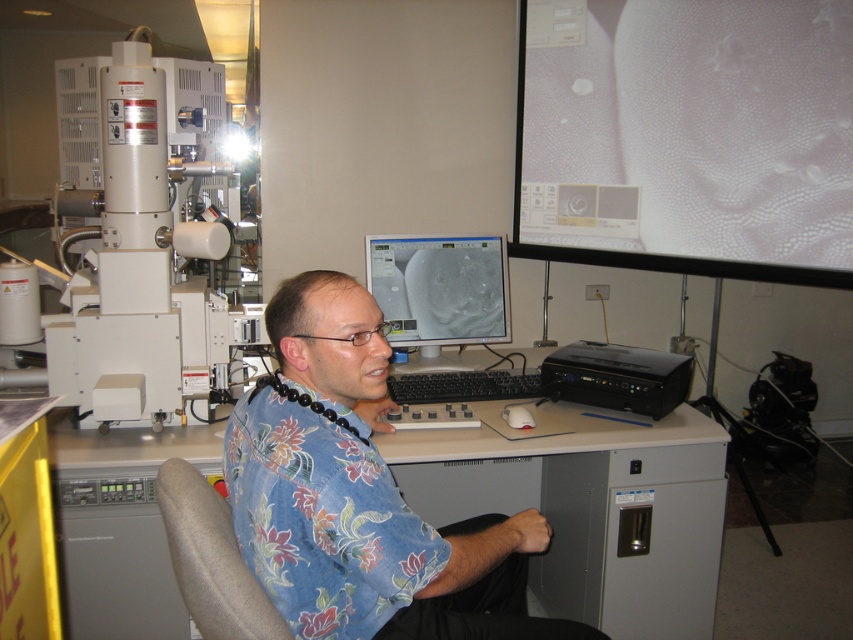
Is white matte projection screen at upper right closer to the viewer compared to blue floral shirt at center?

That is False.

Describe the element at coordinates (688, 136) in the screenshot. The image size is (853, 640). I see `white matte projection screen at upper right` at that location.

This screenshot has width=853, height=640. I want to click on white matte projection screen at upper right, so click(x=688, y=136).

Find the location of `white matte projection screen at upper right`. white matte projection screen at upper right is located at coordinates (688, 136).

The width and height of the screenshot is (853, 640). Describe the element at coordinates (360, 493) in the screenshot. I see `blue floral shirt at center` at that location.

Which is more to the right, blue floral shirt at center or matte gray monitor at center?

From the viewer's perspective, matte gray monitor at center appears more on the right side.

Image resolution: width=853 pixels, height=640 pixels. What do you see at coordinates (360, 493) in the screenshot?
I see `blue floral shirt at center` at bounding box center [360, 493].

You are a GUI agent. You are given a task and a screenshot of the screen. Output one action in this format:
    pyautogui.click(x=<x>, y=<y>)
    Task: Click on the blue floral shirt at center
    This screenshot has width=853, height=640.
    Given the screenshot: What is the action you would take?
    pyautogui.click(x=360, y=493)

Is blue floral shirt at center below gray fabric chair at center?

Indeed, blue floral shirt at center is positioned under gray fabric chair at center.

Who is taller, blue floral shirt at center or gray fabric chair at center?

With more height is blue floral shirt at center.

Is point (291, 284) closer to camera compared to point (187, 576)?

No.

Where is `blue floral shirt at center`? blue floral shirt at center is located at coordinates (360, 493).